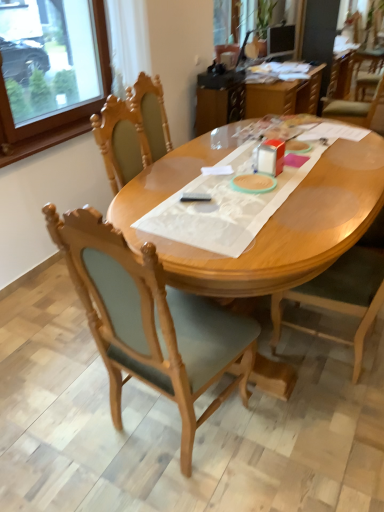
Question: Is wooden frame at upper left taller than translucent plastic table at upper center?

Choices:
 (A) yes
 (B) no

Answer: (A)

Question: Considering the relative sizes of wooden frame at upper left and translucent plastic table at upper center in the image provided, is wooden frame at upper left bigger than translucent plastic table at upper center?

Choices:
 (A) yes
 (B) no

Answer: (B)

Question: From a real-world perspective, is wooden frame at upper left below translucent plastic table at upper center?

Choices:
 (A) no
 (B) yes

Answer: (A)

Question: Is wooden frame at upper left completely or partially outside of translucent plastic table at upper center?

Choices:
 (A) no
 (B) yes

Answer: (B)

Question: From the image's perspective, is wooden frame at upper left located above translucent plastic table at upper center?

Choices:
 (A) no
 (B) yes

Answer: (A)

Question: Does wooden frame at upper left have a greater width compared to translucent plastic table at upper center?

Choices:
 (A) yes
 (B) no

Answer: (B)

Question: Is there a large distance between wooden frame at upper left and light brown wood desk at center?

Choices:
 (A) yes
 (B) no

Answer: (A)

Question: From a real-world perspective, is wooden frame at upper left under light brown wood desk at center?

Choices:
 (A) no
 (B) yes

Answer: (A)

Question: Considering the relative sizes of wooden frame at upper left and light brown wood desk at center in the image provided, is wooden frame at upper left shorter than light brown wood desk at center?

Choices:
 (A) yes
 (B) no

Answer: (B)

Question: Considering the relative positions of wooden frame at upper left and light brown wood desk at center in the image provided, is wooden frame at upper left behind light brown wood desk at center?

Choices:
 (A) yes
 (B) no

Answer: (A)

Question: Is the position of wooden frame at upper left less distant than that of light brown wood desk at center?

Choices:
 (A) no
 (B) yes

Answer: (A)

Question: Is wooden frame at upper left located outside light brown wood desk at center?

Choices:
 (A) yes
 (B) no

Answer: (A)

Question: Is wooden chair at center, placed as the 1th chair when sorted from left to right, located within wooden chair at center, the 2th chair viewed from the left?

Choices:
 (A) no
 (B) yes

Answer: (A)